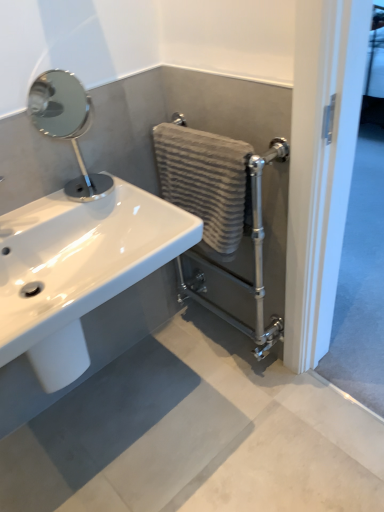
Image resolution: width=384 pixels, height=512 pixels. What do you see at coordinates (78, 269) in the screenshot?
I see `white glossy sink at lower left` at bounding box center [78, 269].

This screenshot has height=512, width=384. I want to click on polished chrome mirror at upper left, so click(x=67, y=125).

Where is `textured beige towel at center-right`? Image resolution: width=384 pixels, height=512 pixels. textured beige towel at center-right is located at coordinates (204, 179).

What do you see at coordinates (204, 179) in the screenshot? Image resolution: width=384 pixels, height=512 pixels. I see `textured beige towel at center-right` at bounding box center [204, 179].

This screenshot has height=512, width=384. In order to click on white glossy sink at lower left in this screenshot , I will do `click(78, 269)`.

Considering the sizes of objects matte gray concrete at lower center and white glossy sink at lower left in the image provided, who is smaller, matte gray concrete at lower center or white glossy sink at lower left?

white glossy sink at lower left is smaller.

From a real-world perspective, between matte gray concrete at lower center and white glossy sink at lower left, who is vertically lower?

matte gray concrete at lower center.

Based on the photo, in the image, is matte gray concrete at lower center positioned in front of or behind white glossy sink at lower left?

matte gray concrete at lower center is behind white glossy sink at lower left.

Is matte gray concrete at lower center looking in the opposite direction of white glossy sink at lower left?

No.

Find the location of `concrete that appears below the white glossy sink at lower left (from the image's perspective)`. concrete that appears below the white glossy sink at lower left (from the image's perspective) is located at coordinates (195, 434).

From the image's perspective, which object appears higher, white glossy sink at lower left or matte gray concrete at lower center?

white glossy sink at lower left, from the image's perspective.

Considering their positions, is white glossy sink at lower left located in front of or behind matte gray concrete at lower center?

Visually, white glossy sink at lower left is located in front of matte gray concrete at lower center.

Considering the relative positions of white glossy sink at lower left and matte gray concrete at lower center in the image provided, is white glossy sink at lower left to the left of matte gray concrete at lower center from the viewer's perspective?

Indeed, white glossy sink at lower left is positioned on the left side of matte gray concrete at lower center.

How many degrees apart are the facing directions of white glossy sink at lower left and polished chrome mirror at upper left?

The angular difference between white glossy sink at lower left and polished chrome mirror at upper left is 1.83 degrees.

Can you confirm if white glossy sink at lower left is smaller than polished chrome mirror at upper left?

No.

Is white glossy sink at lower left turned away from polished chrome mirror at upper left?

That's not correct — white glossy sink at lower left is not looking away from polished chrome mirror at upper left.

From the image's perspective, between white glossy sink at lower left and polished chrome mirror at upper left, which one is located above?

polished chrome mirror at upper left, from the image's perspective.

From the image's perspective, is textured beige towel at center-right on white glossy sink at lower left?

Correct, textured beige towel at center-right appears higher than white glossy sink at lower left in the image.

Does textured beige towel at center-right lie behind white glossy sink at lower left?

Yes, textured beige towel at center-right is further from the camera.

Is point (235, 207) closer or farther from the camera than point (41, 313)?

Point (235, 207) is positioned farther from the camera compared to point (41, 313).

Does textured beige towel at center-right have a greater height compared to white glossy sink at lower left?

Yes, textured beige towel at center-right is taller than white glossy sink at lower left.

Is white glossy sink at lower left inside or outside of textured beige towel at center-right?

The correct answer is: outside.

Considering the relative sizes of white glossy sink at lower left and textured beige towel at center-right in the image provided, is white glossy sink at lower left shorter than textured beige towel at center-right?

Indeed, white glossy sink at lower left has a lesser height compared to textured beige towel at center-right.

At what (x,y) coordinates should I click in order to perform the action: click on sink located above the textured beige towel at center-right (from a real-world perspective). Please return your answer as a coordinate pair (x, y). Looking at the image, I should click on (78, 269).

Are white glossy sink at lower left and textured beige towel at center-right located far from each other?

No, white glossy sink at lower left is in close proximity to textured beige towel at center-right.

Is point (78, 151) closer or farther from the camera than point (140, 267)?

Clearly, point (78, 151) is more distant from the camera than point (140, 267).

Is polished chrome mirror at upper left not close to white glossy sink at lower left?

No, polished chrome mirror at upper left is in close proximity to white glossy sink at lower left.

Consider the image. Is polished chrome mirror at upper left facing towards white glossy sink at lower left?

No.

From the image's perspective, between polished chrome mirror at upper left and white glossy sink at lower left, who is located below?

white glossy sink at lower left, from the image's perspective.

Are polished chrome mirror at upper left and textured beige towel at center-right making contact?

polished chrome mirror at upper left and textured beige towel at center-right are not in contact.

Considering the positions of objects polished chrome mirror at upper left and textured beige towel at center-right in the image provided, who is behind, polished chrome mirror at upper left or textured beige towel at center-right?

textured beige towel at center-right.

Does polished chrome mirror at upper left appear on the right side of textured beige towel at center-right?

No, polished chrome mirror at upper left is not to the right of textured beige towel at center-right.

Measure the distance between polished chrome mirror at upper left and textured beige towel at center-right.

polished chrome mirror at upper left and textured beige towel at center-right are 26.75 inches apart from each other.

This screenshot has height=512, width=384. I want to click on concrete on the right of white glossy sink at lower left, so click(x=195, y=434).

What are the coordinates of `sink positioned vertically above the matte gray concrete at lower center (from a real-world perspective)` in the screenshot? It's located at (78, 269).

From the image, which object appears to be farther from matte gray concrete at lower center, white glossy sink at lower left or polished chrome mirror at upper left?

polished chrome mirror at upper left lies further to matte gray concrete at lower center than the other object.

Considering their positions, is polished chrome mirror at upper left positioned further to matte gray concrete at lower center than white glossy sink at lower left?

The object further to matte gray concrete at lower center is polished chrome mirror at upper left.

Estimate the real-world distances between objects in this image. Which object is further from white glossy sink at lower left, matte gray concrete at lower center or polished chrome mirror at upper left?

Based on the image, polished chrome mirror at upper left appears to be further to white glossy sink at lower left.

Estimate the real-world distances between objects in this image. Which object is closer to polished chrome mirror at upper left, textured beige towel at center-right or white glossy sink at lower left?

textured beige towel at center-right is positioned closer to the anchor polished chrome mirror at upper left.

Based on the photo, estimate the real-world distances between objects in this image. Which object is further from polished chrome mirror at upper left, matte gray concrete at lower center or textured beige towel at center-right?

Based on the image, matte gray concrete at lower center appears to be further to polished chrome mirror at upper left.

Which object lies nearer to the anchor point textured beige towel at center-right, polished chrome mirror at upper left or white glossy sink at lower left?

The object closer to textured beige towel at center-right is white glossy sink at lower left.

From the image, which object appears to be nearer to textured beige towel at center-right, polished chrome mirror at upper left or matte gray concrete at lower center?

polished chrome mirror at upper left is positioned closer to the anchor textured beige towel at center-right.

Considering their positions, is matte gray concrete at lower center positioned closer to textured beige towel at center-right than white glossy sink at lower left?

white glossy sink at lower left.

Where is `plumbing fixture located between white glossy sink at lower left and textured beige towel at center-right in the left-right direction`? The image size is (384, 512). plumbing fixture located between white glossy sink at lower left and textured beige towel at center-right in the left-right direction is located at coordinates tap(67, 125).

Locate an element on the screen. This screenshot has height=512, width=384. sink between textured beige towel at center-right and matte gray concrete at lower center in the vertical direction is located at coordinates (78, 269).

Locate an element on the screen. The height and width of the screenshot is (512, 384). bath towel between polished chrome mirror at upper left and matte gray concrete at lower center in the up-down direction is located at coordinates (204, 179).

In order to click on sink between polished chrome mirror at upper left and matte gray concrete at lower center in the up-down direction in this screenshot , I will do `click(78, 269)`.